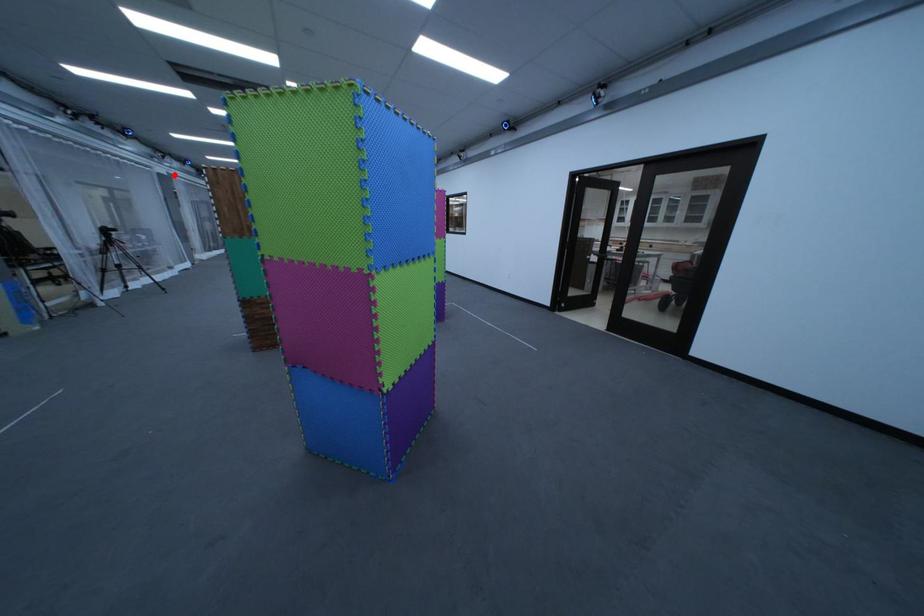
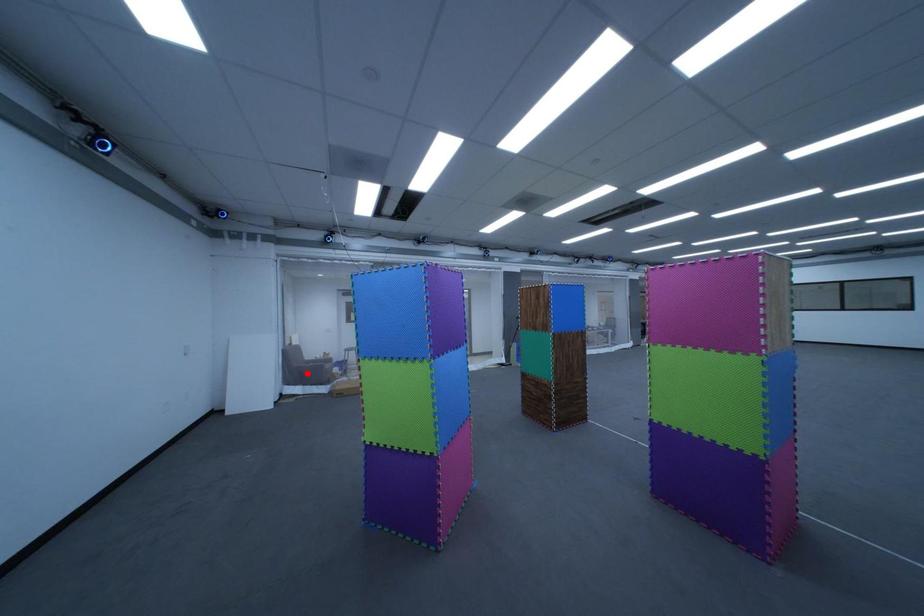
I am providing you with two images of the same scene from different viewpoints. A red point is marked on the first image and another point is marked on the second image. Are the points marked in image1 and image2 representing the same 3D position?

No